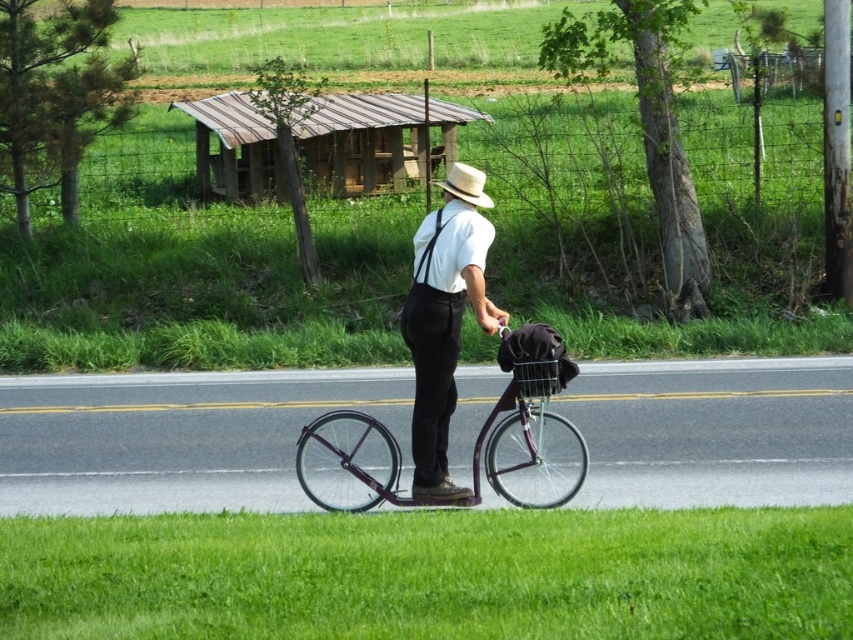
Describe the element at coordinates (376, 140) in the screenshot. I see `metal/wooden hut at upper center` at that location.

Can you confirm if metal/wooden hut at upper center is positioned to the right of straw hat at center?

Incorrect, metal/wooden hut at upper center is not on the right side of straw hat at center.

Is point (303, 125) in front of point (450, 184)?

No, (303, 125) is further to viewer.

Identify the location of metal/wooden hut at upper center. (376, 140).

Is white matte shirt at center positioned at the back of black fabric suspenders at center?

No, white matte shirt at center is closer to the viewer.

Is point (479, 291) closer to viewer compared to point (428, 262)?

Yes, it is.

The width and height of the screenshot is (853, 640). In order to click on white matte shirt at center in this screenshot , I will do `click(444, 320)`.

The image size is (853, 640). What do you see at coordinates (537, 378) in the screenshot?
I see `metallic wire basket at center` at bounding box center [537, 378].

Does metallic wire basket at center have a greater width compared to straw hat at center?

No, metallic wire basket at center is not wider than straw hat at center.

Which is behind, point (515, 369) or point (473, 189)?

The point (473, 189) is behind.

The height and width of the screenshot is (640, 853). In order to click on metallic wire basket at center in this screenshot , I will do (537, 378).